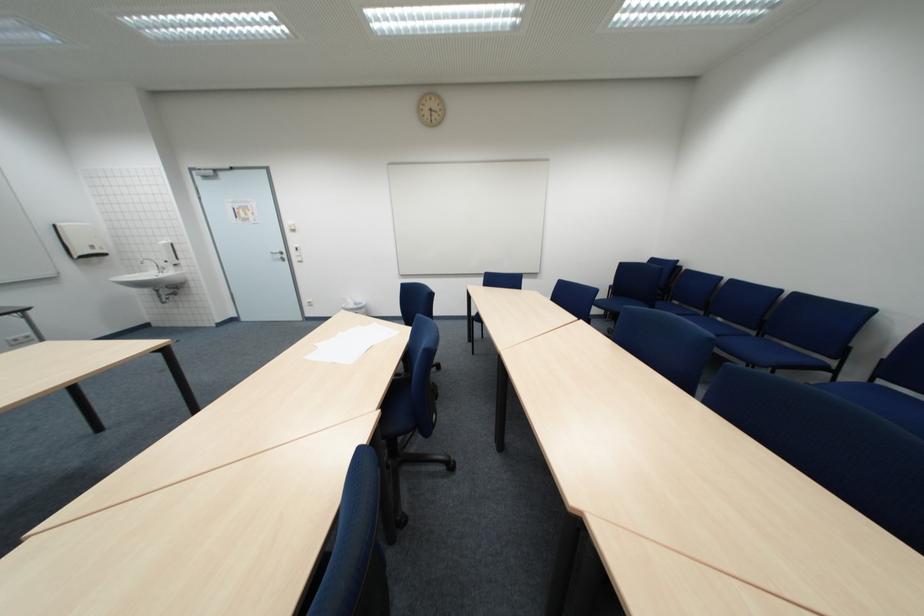
Describe the element at coordinates (150, 264) in the screenshot. The width and height of the screenshot is (924, 616). I see `the sink faucet handle` at that location.